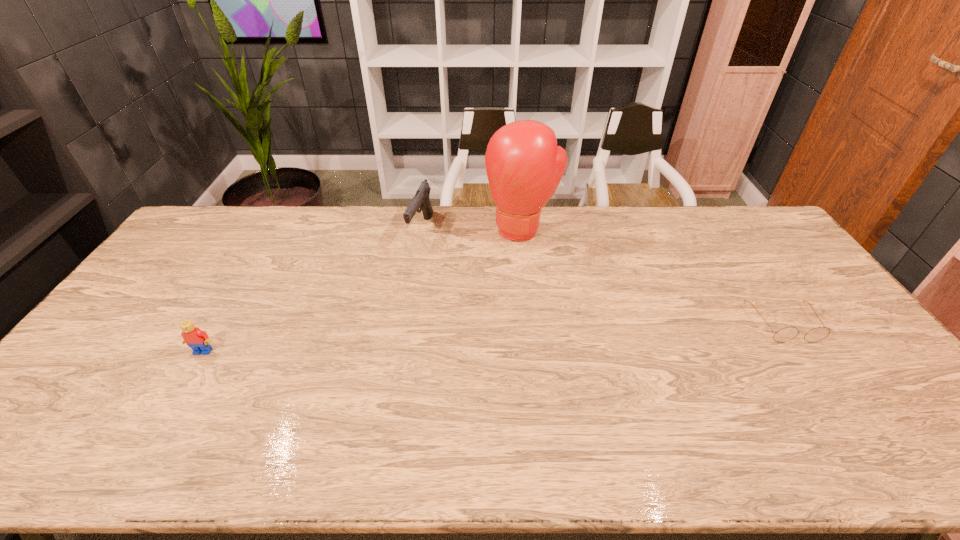
This screenshot has height=540, width=960. In the image, there is a desktop. Find the location of `vacant space at the near edge`. vacant space at the near edge is located at coordinates (528, 408).

Image resolution: width=960 pixels, height=540 pixels. In the image, there is a desktop. Identify the location of vacant area at the left edge. (92, 377).

In the image, there is a desktop. At what (x,y) coordinates should I click in order to perform the action: click on vacant space at the far left corner. Please return your answer as a coordinate pair (x, y). This screenshot has height=540, width=960. Looking at the image, I should click on (220, 231).

Identify the location of vacant space at the near left corner of the desktop. The height and width of the screenshot is (540, 960). (71, 396).

Where is `vacant area at the far right corner of the desktop`? This screenshot has width=960, height=540. vacant area at the far right corner of the desktop is located at coordinates (742, 239).

Where is `free space between the boxing glove and the spectacles`? free space between the boxing glove and the spectacles is located at coordinates (653, 276).

At what (x,y) coordinates should I click in order to perform the action: click on free space between the gun and the third object from left to right. Please return your answer as a coordinate pair (x, y). This screenshot has height=540, width=960. Looking at the image, I should click on (471, 230).

This screenshot has height=540, width=960. What are the coordinates of `empty location between the third object from left to right and the spectacles` in the screenshot? It's located at (653, 276).

This screenshot has height=540, width=960. I want to click on vacant space that's between the second shortest object and the third farthest object, so click(493, 338).

Identify the location of free space between the second shortest object and the second object from right to left. The image size is (960, 540). (363, 291).